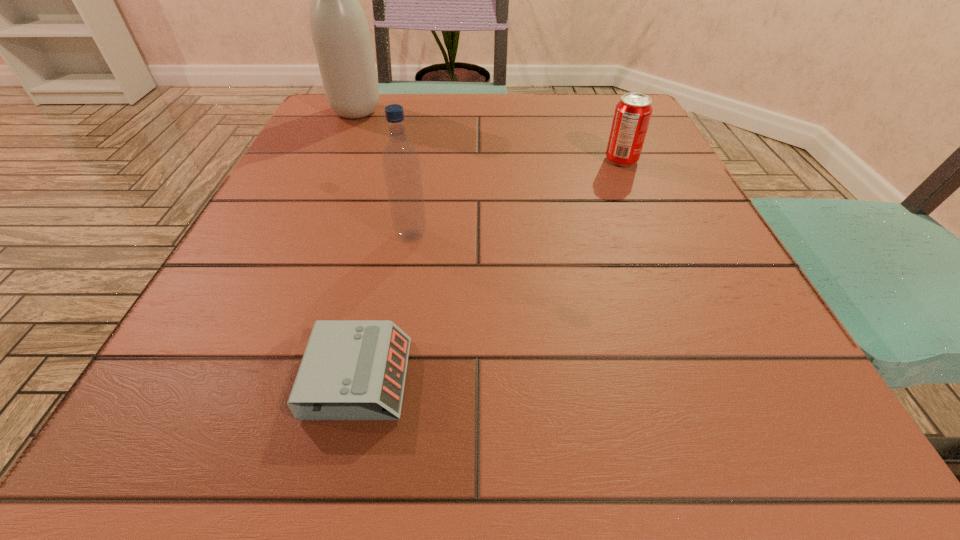
Find the location of a particular element. The height and width of the screenshot is (540, 960). vacant region at the right edge of the desktop is located at coordinates (749, 369).

Image resolution: width=960 pixels, height=540 pixels. In the image, there is a desktop. In order to click on vacant area at the near left corner in this screenshot , I will do pos(153,426).

Locate an element on the screen. This screenshot has width=960, height=540. vacant space that is in between the second shortest object and the shortest object is located at coordinates (490, 269).

Locate an element on the screen. Image resolution: width=960 pixels, height=540 pixels. vacant region between the nearest object and the tallest object is located at coordinates point(357,245).

The width and height of the screenshot is (960, 540). In order to click on free space between the nearest object and the leftmost object in this screenshot , I will do `click(357, 245)`.

Find the location of a particular element. The width and height of the screenshot is (960, 540). vacant point located between the water bottle and the soda is located at coordinates (516, 198).

This screenshot has height=540, width=960. I want to click on vacant area that lies between the nearest object and the second tallest object, so click(385, 307).

At what (x,y) coordinates should I click in order to perform the action: click on free space that is in between the farthest object and the soda. Please return your answer as a coordinate pair (x, y). This screenshot has width=960, height=540. Looking at the image, I should click on (489, 136).

The height and width of the screenshot is (540, 960). I want to click on empty space between the rightmost object and the third farthest object, so click(x=516, y=198).

Identify the location of unoccupied position between the nearest object and the third nearest object. (490, 269).